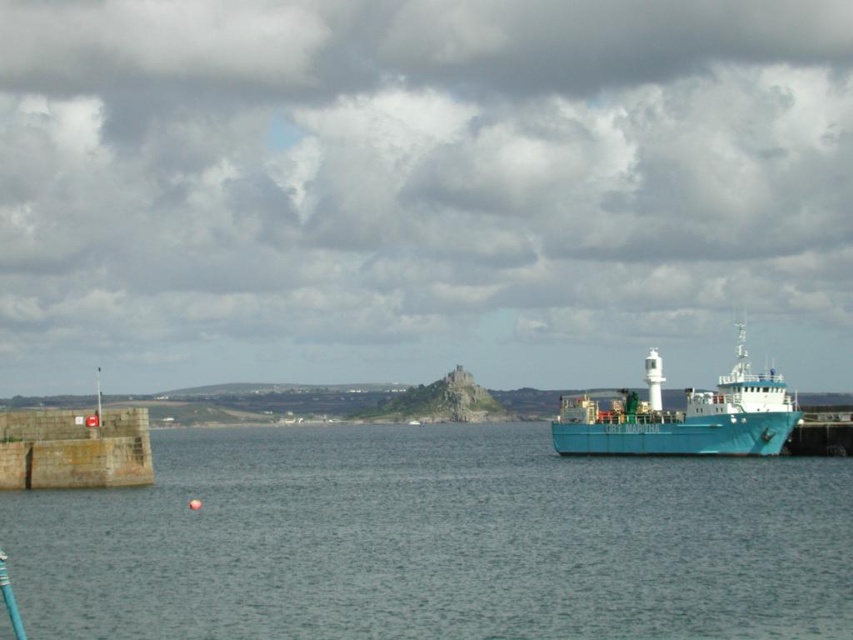
Which is more to the right, blue water at center or teal matte ship at right?

teal matte ship at right is more to the right.

Which is in front, point (10, 556) or point (755, 451)?

Point (10, 556)

Which is in front, point (181, 602) or point (703, 401)?

Point (181, 602)

This screenshot has width=853, height=640. Identify the location of blue water at center. (434, 541).